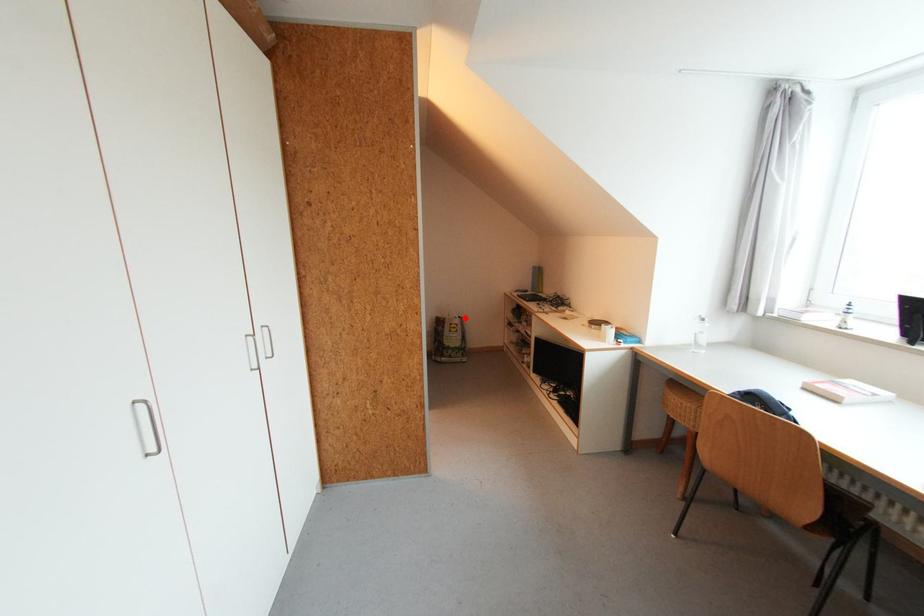
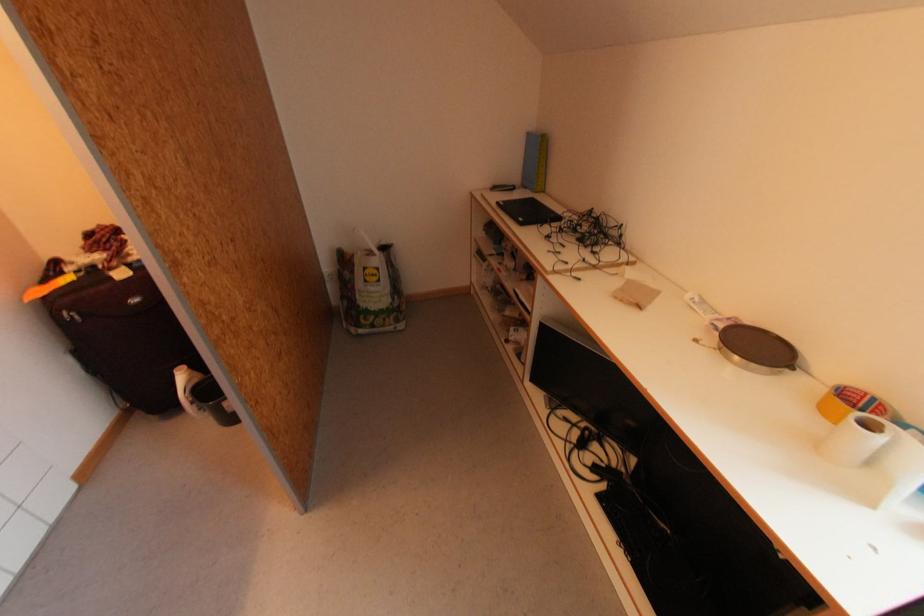
Question: A red point is marked in image1. In image2, is the corresponding 3D point closer to the camera or farther? Reply with the corresponding letter.

Choices:
 (A) The corresponding 3D point is closer.
 (B) The corresponding 3D point is farther.

Answer: (A)